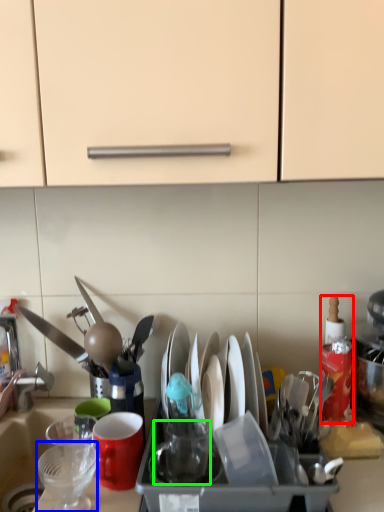
Question: Which object is the farthest from bottle (highlighted by a red box)? Choose among these: tableware (highlighted by a blue box) or tableware (highlighted by a green box).

Choices:
 (A) tableware
 (B) tableware

Answer: (A)